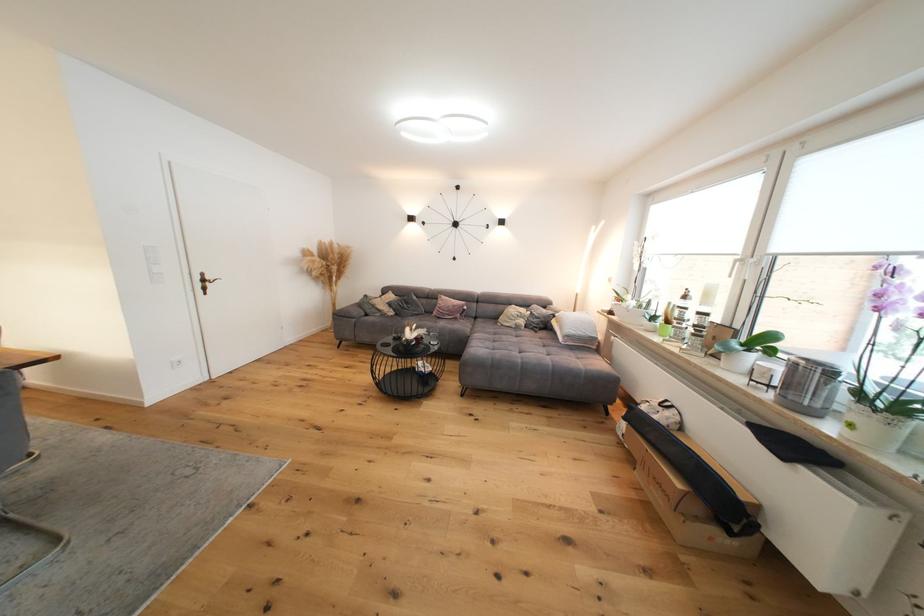
Image resolution: width=924 pixels, height=616 pixels. Describe the element at coordinates (508, 346) in the screenshot. I see `a sofa sitting surface` at that location.